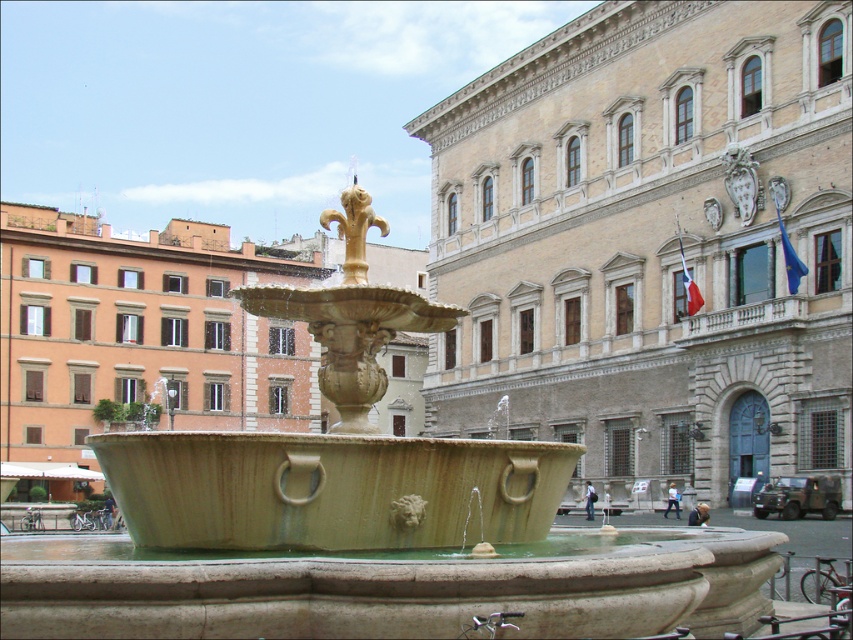
Question: Which point is closer to the camera?

Choices:
 (A) (28, 620)
 (B) (361, 250)

Answer: (A)

Question: Can you confirm if stone fountain at center is positioned above gold polished metal fleur-de-lis at center?

Choices:
 (A) yes
 (B) no

Answer: (B)

Question: Is stone fountain at center positioned behind gold polished metal fleur-de-lis at center?

Choices:
 (A) no
 (B) yes

Answer: (A)

Question: Does stone fountain at center appear on the right side of gold polished metal fleur-de-lis at center?

Choices:
 (A) yes
 (B) no

Answer: (A)